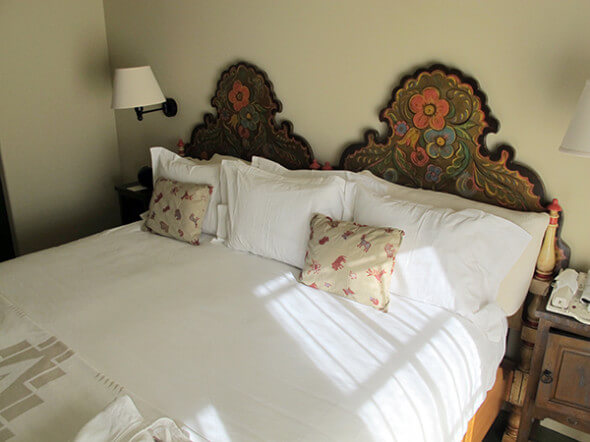
The width and height of the screenshot is (590, 442). I want to click on throw pillows, so click(x=330, y=250), click(x=185, y=205).